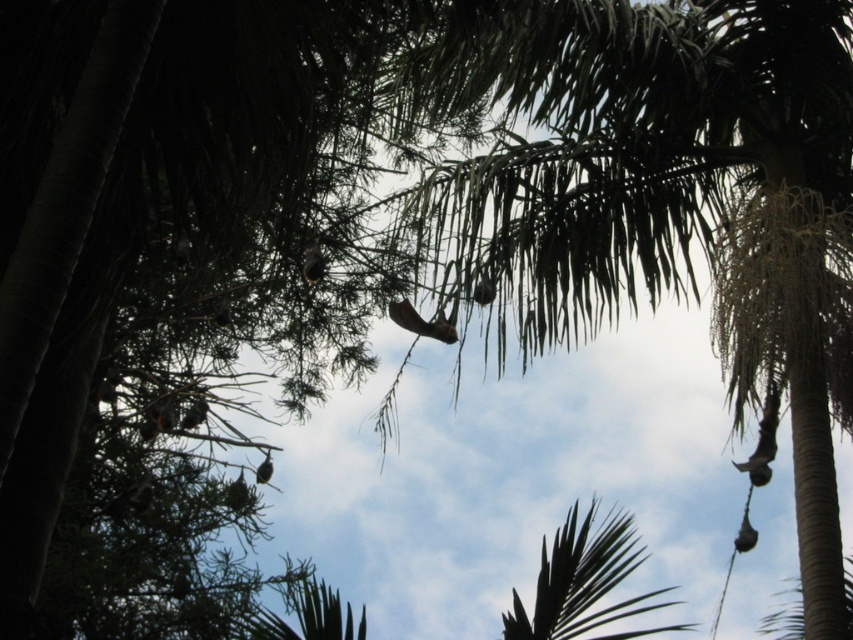
Question: Which object is closer to the camera taking this photo?

Choices:
 (A) green leafy palm tree at upper center
 (B) green leafy palm at center

Answer: (B)

Question: Is green leafy palm tree at upper center bigger than green leafy palm at center?

Choices:
 (A) no
 (B) yes

Answer: (B)

Question: Which point appears farthest from the camera in this image?

Choices:
 (A) (454, 256)
 (B) (608, 564)

Answer: (A)

Question: Observing the image, what is the correct spatial positioning of green leafy palm tree at upper center in reference to green leafy palm at center?

Choices:
 (A) below
 (B) above

Answer: (B)

Question: Can you confirm if green leafy palm tree at upper center is thinner than green leafy palm at center?

Choices:
 (A) yes
 (B) no

Answer: (B)